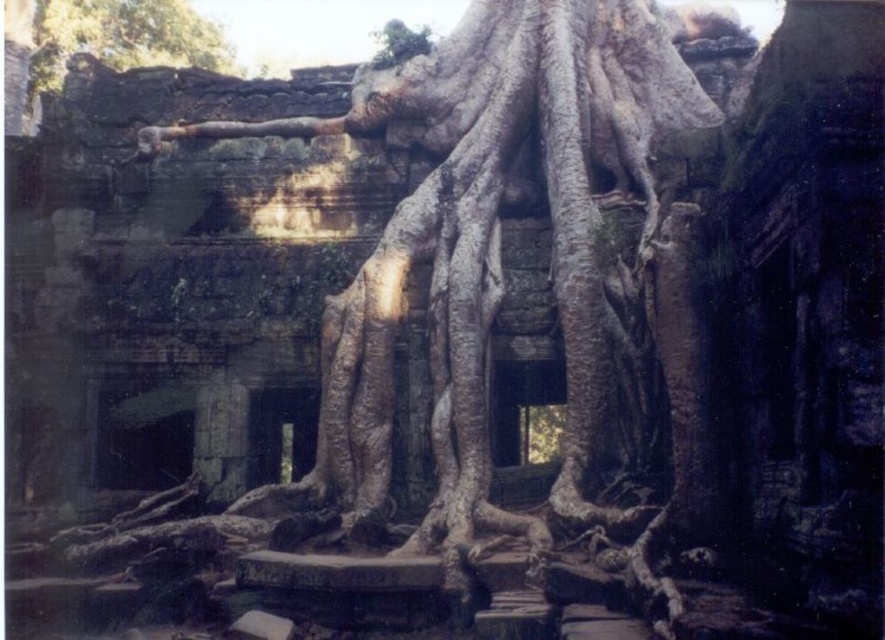
Question: Which object appears farthest from the camera in this image?

Choices:
 (A) brown textured roots at upper left
 (B) gray textured roots at center

Answer: (A)

Question: Is gray textured roots at center to the right of brown textured roots at upper left from the viewer's perspective?

Choices:
 (A) no
 (B) yes

Answer: (B)

Question: In this image, where is gray textured roots at center located relative to brown textured roots at upper left?

Choices:
 (A) left
 (B) right

Answer: (B)

Question: Is gray textured roots at center positioned before brown textured roots at upper left?

Choices:
 (A) no
 (B) yes

Answer: (B)